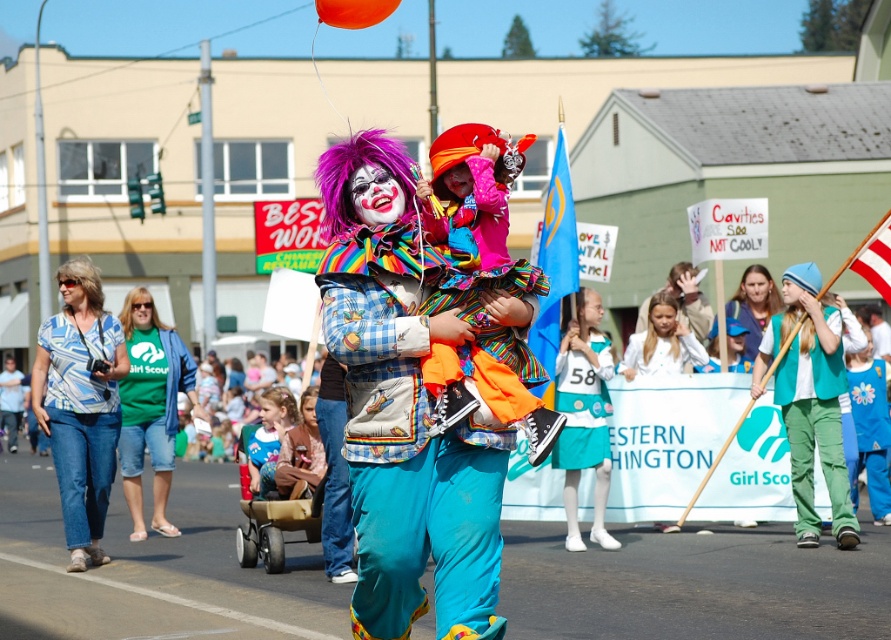
Is green fabric shirt at center thinner than green velvety vest at center?

Yes.

Who is taller, green fabric shirt at center or green velvety vest at center?

With more height is green fabric shirt at center.

Does point (185, 384) come in front of point (831, 502)?

No.

The height and width of the screenshot is (640, 891). In order to click on green fabric shirt at center in this screenshot , I will do `click(150, 406)`.

Does blue printed shirt at left appear on the right side of blonde synthetic wig at upper left?

Indeed, blue printed shirt at left is positioned on the right side of blonde synthetic wig at upper left.

Who is positioned more to the left, blue printed shirt at left or blonde synthetic wig at upper left?

blonde synthetic wig at upper left

Identify the location of blue printed shirt at left. (80, 404).

Which is in front, point (97, 296) or point (123, 314)?

Point (97, 296) is more forward.

Is point (71, 266) more distant than point (123, 323)?

No, (71, 266) is closer to viewer.

Measure the distance between point (91,304) and camera.

The distance of point (91,304) from camera is 15.95 meters.

The width and height of the screenshot is (891, 640). Find the location of `blonde synthetic wig at upper left`. blonde synthetic wig at upper left is located at coordinates (83, 280).